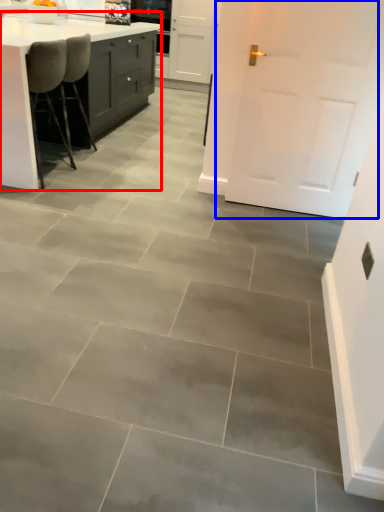
Question: Among these objects, which one is farthest to the camera, countertop (highlighted by a red box) or door (highlighted by a blue box)?

Choices:
 (A) countertop
 (B) door

Answer: (A)